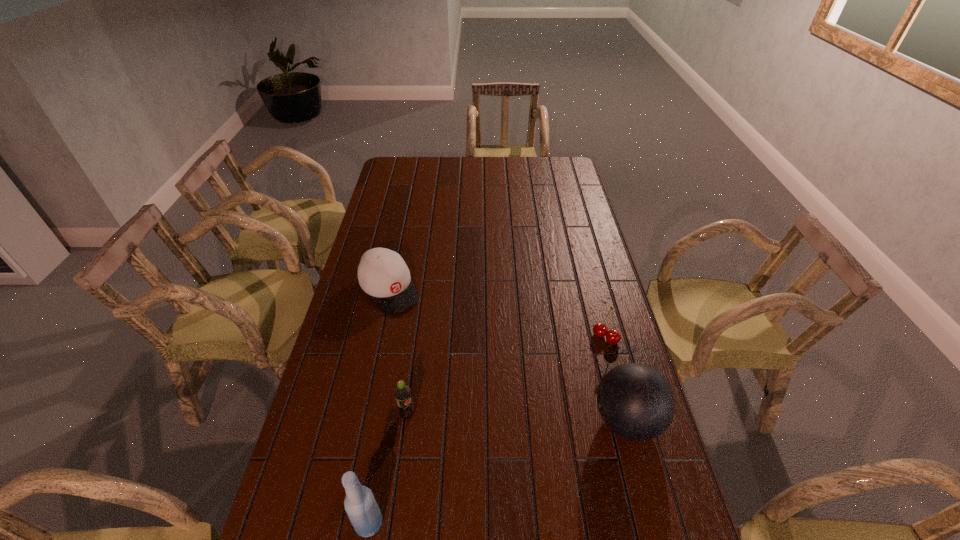
The width and height of the screenshot is (960, 540). Identify the location of the nearest object. (360, 505).

Where is `bottle`? The width and height of the screenshot is (960, 540). bottle is located at coordinates (360, 505).

Locate an element on the screen. The image size is (960, 540). the fourth shortest object is located at coordinates (636, 402).

Where is `the farthest object`? The image size is (960, 540). the farthest object is located at coordinates (382, 273).

Locate an element on the screen. The width and height of the screenshot is (960, 540). the second farthest object is located at coordinates (600, 330).

Identify the location of soda. (402, 392).

The height and width of the screenshot is (540, 960). I want to click on free space located on the right of the nearest object, so click(x=532, y=523).

This screenshot has width=960, height=540. Identify the location of vacant position located on the grip area of the second tallest object. (543, 421).

The width and height of the screenshot is (960, 540). Identify the location of free point located 0.320m on the grip area of the second tallest object. (473, 421).

Where is `vacant space located on the grip area of the second tallest object`? The image size is (960, 540). vacant space located on the grip area of the second tallest object is located at coordinates (514, 421).